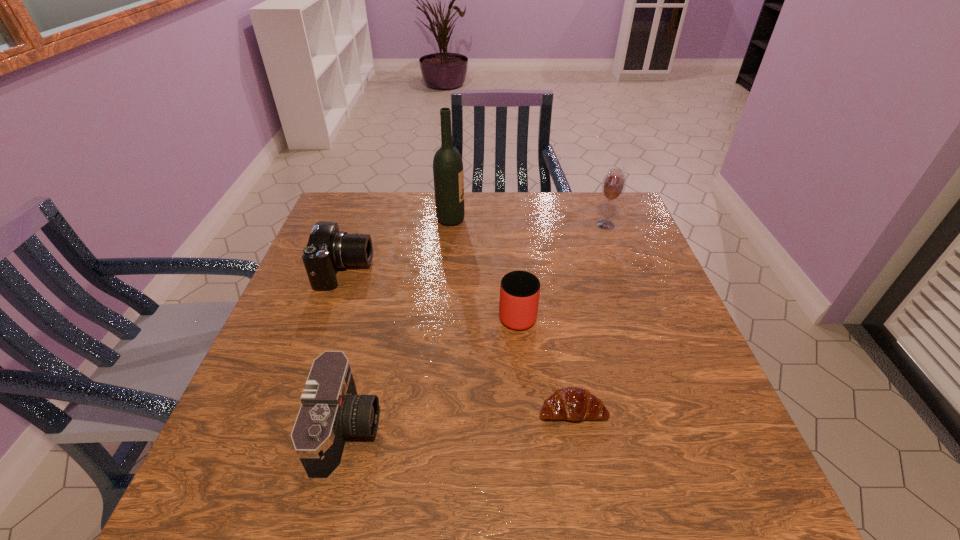
The height and width of the screenshot is (540, 960). Identify the location of wine bottle. pyautogui.click(x=448, y=174).

Locate an element on the screen. This screenshot has width=960, height=540. the third object from left to right is located at coordinates (448, 174).

The height and width of the screenshot is (540, 960). I want to click on the second tallest object, so click(x=613, y=186).

Where is `wineglass`? The height and width of the screenshot is (540, 960). wineglass is located at coordinates (613, 186).

Locate an element on the screen. the third farthest object is located at coordinates (328, 249).

Locate an element on the screen. The image size is (960, 540). cup is located at coordinates (519, 290).

In order to click on the nearer camera in this screenshot , I will do `click(331, 410)`.

Find the location of a particular element. the shortest object is located at coordinates (572, 403).

At what (x,y) coordinates should I click in order to perform the action: click on vacant point located on the labeled side of the tallest object. Please return your answer as a coordinate pair (x, y). The image size is (960, 540). Looking at the image, I should click on coord(546,220).

Locate an element on the screen. free space located 0.290m on the front of the rightmost object is located at coordinates (633, 299).